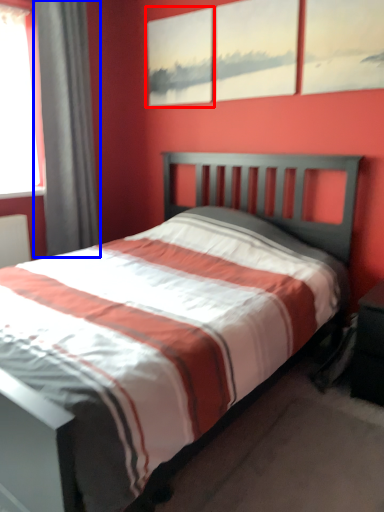
Question: Among these objects, which one is farthest to the camera, picture frame (highlighted by a red box) or curtain (highlighted by a blue box)?

Choices:
 (A) picture frame
 (B) curtain

Answer: (A)